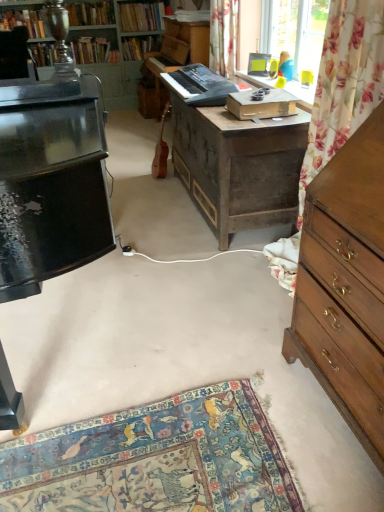
This screenshot has width=384, height=512. Describe the element at coordinates (93, 51) in the screenshot. I see `hardcover book at upper left, which appears as the 3th book when viewed from the right` at that location.

Image resolution: width=384 pixels, height=512 pixels. What do you see at coordinates (91, 13) in the screenshot?
I see `hardcover book at upper left, marked as the 4th book in a right-to-left arrangement` at bounding box center [91, 13].

This screenshot has height=512, width=384. What do you see at coordinates (139, 46) in the screenshot? I see `hardcover book at upper center, which is the 5th book in left-to-right order` at bounding box center [139, 46].

Image resolution: width=384 pixels, height=512 pixels. What do you see at coordinates (24, 22) in the screenshot? I see `hardcover book at upper left, the first book viewed from the left` at bounding box center [24, 22].

In order to click on black glossy piano at left, acting as the third piano starting from the back in this screenshot , I will do `click(52, 191)`.

The height and width of the screenshot is (512, 384). Describe the element at coordinates (161, 150) in the screenshot. I see `brown wood guitar at center` at that location.

Where is `hardcover book at upper left, which is the third book in left-to-right order`? This screenshot has width=384, height=512. hardcover book at upper left, which is the third book in left-to-right order is located at coordinates (93, 51).

Does black glossy piano at left, acting as the third piano starting from the back, have a lesser height compared to floral fabric at upper right?

Yes, black glossy piano at left, acting as the third piano starting from the back, is shorter than floral fabric at upper right.

Is black glossy piano at left, the first piano when ordered from front to back, far away from floral fabric at upper right?

black glossy piano at left, the first piano when ordered from front to back, is far away from floral fabric at upper right.

Is the depth of hardcover book at upper left, which is the third book in left-to-right order, greater than that of wooden desk at center?

Yes, hardcover book at upper left, which is the third book in left-to-right order, is further from the camera.

Is hardcover book at upper left, which is the third book in left-to-right order, positioned with its back to wooden desk at center?

hardcover book at upper left, which is the third book in left-to-right order, does not have its back to wooden desk at center.

Between hardcover book at upper left, which appears as the 3th book when viewed from the right, and wooden desk at center, which one has smaller width?

hardcover book at upper left, which appears as the 3th book when viewed from the right.

Is black plastic keyboard at center, acting as the second piano starting from the back, positioned in front of black glossy piano at left, acting as the third piano starting from the back?

No, black plastic keyboard at center, acting as the second piano starting from the back, is behind black glossy piano at left, acting as the third piano starting from the back.

Based on the photo, considering the sizes of black plastic keyboard at center, acting as the second piano starting from the back, and black glossy piano at left, the first piano when ordered from front to back, in the image, is black plastic keyboard at center, acting as the second piano starting from the back, wider or thinner than black glossy piano at left, the first piano when ordered from front to back,?

In the image, black plastic keyboard at center, acting as the second piano starting from the back, appears to be more narrow than black glossy piano at left, the first piano when ordered from front to back.

Can you confirm if black plastic keyboard at center, which is the 2th piano in front-to-back order, is taller than black glossy piano at left, the first piano when ordered from front to back?

No, black plastic keyboard at center, which is the 2th piano in front-to-back order, is not taller than black glossy piano at left, the first piano when ordered from front to back.

Considering the positions of objects black plastic keyboard at center, which is the 2th piano in front-to-back order, and black glossy piano at left, acting as the third piano starting from the back, in the image provided, who is more to the left, black plastic keyboard at center, which is the 2th piano in front-to-back order, or black glossy piano at left, acting as the third piano starting from the back,?

black glossy piano at left, acting as the third piano starting from the back, is more to the left.

Is hardcover book at upper left, which is the third book in left-to-right order, inside or outside of black matte keyboard at center, which is the 3th piano in front-to-back order?

hardcover book at upper left, which is the third book in left-to-right order, exists outside the volume of black matte keyboard at center, which is the 3th piano in front-to-back order.

Between hardcover book at upper left, which appears as the 3th book when viewed from the right, and black matte keyboard at center, the first piano from the back, which one has more height?

With more height is black matte keyboard at center, the first piano from the back.

Is point (74, 56) positioned after point (159, 69)?

Yes.

Can you tell me how much hardcover book at upper left, which appears as the 3th book when viewed from the right, and black matte keyboard at center, which is the 3th piano in front-to-back order, differ in facing direction?

The angle between the facing direction of hardcover book at upper left, which appears as the 3th book when viewed from the right, and the facing direction of black matte keyboard at center, which is the 3th piano in front-to-back order, is 90.3 degrees.

Between hardcover book at upper left, the second book in the left-to-right sequence, and black glossy piano at left, acting as the third piano starting from the back, which one appears on the right side from the viewer's perspective?

black glossy piano at left, acting as the third piano starting from the back, is more to the right.

Between hardcover book at upper left, marked as the 4th book in a right-to-left arrangement, and black glossy piano at left, acting as the third piano starting from the back, which one has larger size?

black glossy piano at left, acting as the third piano starting from the back.

From the image's perspective, is hardcover book at upper left, marked as the 4th book in a right-to-left arrangement, located beneath black glossy piano at left, acting as the third piano starting from the back?

No, from the image's perspective, hardcover book at upper left, marked as the 4th book in a right-to-left arrangement, is not beneath black glossy piano at left, acting as the third piano starting from the back.

From the image's perspective, relative to black glossy piano at left, the first piano when ordered from front to back, is hardcover book at upper center, the 2th book when ordered from right to left, above or below?

Clearly, from the image's perspective, hardcover book at upper center, the 2th book when ordered from right to left, is above black glossy piano at left, the first piano when ordered from front to back.

Image resolution: width=384 pixels, height=512 pixels. Identify the location of the 3rd piano below the hardcover book at upper center, the 2th book when ordered from right to left (from the image's perspective). (52, 191).

Considering the sizes of objects hardcover book at upper center, which ranks as the 4th book in left-to-right order, and black glossy piano at left, acting as the third piano starting from the back, in the image provided, who is bigger, hardcover book at upper center, which ranks as the 4th book in left-to-right order, or black glossy piano at left, acting as the third piano starting from the back,?

With larger size is black glossy piano at left, acting as the third piano starting from the back.

Which is in front, point (128, 22) or point (74, 128)?

The point (74, 128) is closer to the camera.

Based on their positions, is floral fabric curtain at upper center located to the left or right of hardcover book at upper center, which is the 5th book in left-to-right order?

In the image, floral fabric curtain at upper center appears on the right side of hardcover book at upper center, which is the 5th book in left-to-right order.

From a real-world perspective, is floral fabric curtain at upper center positioned above or below hardcover book at upper center, which is the 5th book in left-to-right order?

floral fabric curtain at upper center is above hardcover book at upper center, which is the 5th book in left-to-right order.

Identify the location of curtain in front of the hardcover book at upper center, the first book positioned from the right. The width and height of the screenshot is (384, 512). (x=223, y=36).

Would you say floral fabric curtain at upper center is a long distance from hardcover book at upper center, the first book positioned from the right?

floral fabric curtain at upper center is far away from hardcover book at upper center, the first book positioned from the right.

Image resolution: width=384 pixels, height=512 pixels. In order to click on tapestry above the black glossy piano at left, acting as the third piano starting from the back (from the image's perspective) in this screenshot , I will do `click(344, 83)`.

Which book is the 3rd one when counting from the left side of the wooden desk at center? Please provide its 2D coordinates.

[(93, 51)]

Which object lies further to the anchor point wooden desk at center, black glossy piano at left, acting as the third piano starting from the back, or floral fabric curtain at upper center?

The object further to wooden desk at center is black glossy piano at left, acting as the third piano starting from the back.

Estimate the real-world distances between objects in this image. Which object is closer to hardcover book at upper left, which appears as the 3th book when viewed from the right, wooden chest of drawers at right or floral fabric at upper right?

floral fabric at upper right lies closer to hardcover book at upper left, which appears as the 3th book when viewed from the right, than the other object.

From the image, which object appears to be farther from black glossy piano at left, the first piano when ordered from front to back, hardcover book at upper left, marked as the 4th book in a right-to-left arrangement, or hardcover book at upper center, the 2th book when ordered from right to left?

Based on the image, hardcover book at upper left, marked as the 4th book in a right-to-left arrangement, appears to be further to black glossy piano at left, the first piano when ordered from front to back.

Estimate the real-world distances between objects in this image. Which object is closer to wooden desk at center, hardcover book at upper left, the fifth book in the right-to-left sequence, or brown wood guitar at center?

The object closer to wooden desk at center is brown wood guitar at center.

From the image, which object appears to be farther from hardcover book at upper center, the first book positioned from the right, floral fabric curtain at upper center or hardcover book at upper left, which appears as the 3th book when viewed from the right?

Among the two, floral fabric curtain at upper center is located further to hardcover book at upper center, the first book positioned from the right.

When comparing their distances from floral fabric curtain at upper center, does black matte keyboard at center, the first piano from the back, or hardcover book at upper center, which is the 5th book in left-to-right order, seem further?

hardcover book at upper center, which is the 5th book in left-to-right order, is further to floral fabric curtain at upper center.

Looking at the image, which one is located closer to brown wood guitar at center, wooden desk at center or floral fabric curtain at upper center?

Among the two, floral fabric curtain at upper center is located nearer to brown wood guitar at center.

Considering their positions, is floral fabric curtain at upper center positioned further to hardcover book at upper left, marked as the 4th book in a right-to-left arrangement, than floral fabric at upper right?

Based on the image, floral fabric at upper right appears to be further to hardcover book at upper left, marked as the 4th book in a right-to-left arrangement.

What are the coordinates of `curtain positioned between black glossy piano at left, the first piano when ordered from front to back, and hardcover book at upper left, which is the third book in left-to-right order, from near to far` in the screenshot? It's located at coord(223,36).

Image resolution: width=384 pixels, height=512 pixels. I want to click on guitar located between wooden desk at center and hardcover book at upper left, marked as the 4th book in a right-to-left arrangement, in the depth direction, so click(161, 150).

Find the location of a particular element. guitar located between black plastic keyboard at center, which is the 2th piano in front-to-back order, and hardcover book at upper left, which is the third book in left-to-right order, in the depth direction is located at coordinates pos(161,150).

Find the location of a particular element. The height and width of the screenshot is (512, 384). desk positioned between floral fabric at upper right and black matte keyboard at center, the first piano from the back, from near to far is located at coordinates (238, 166).